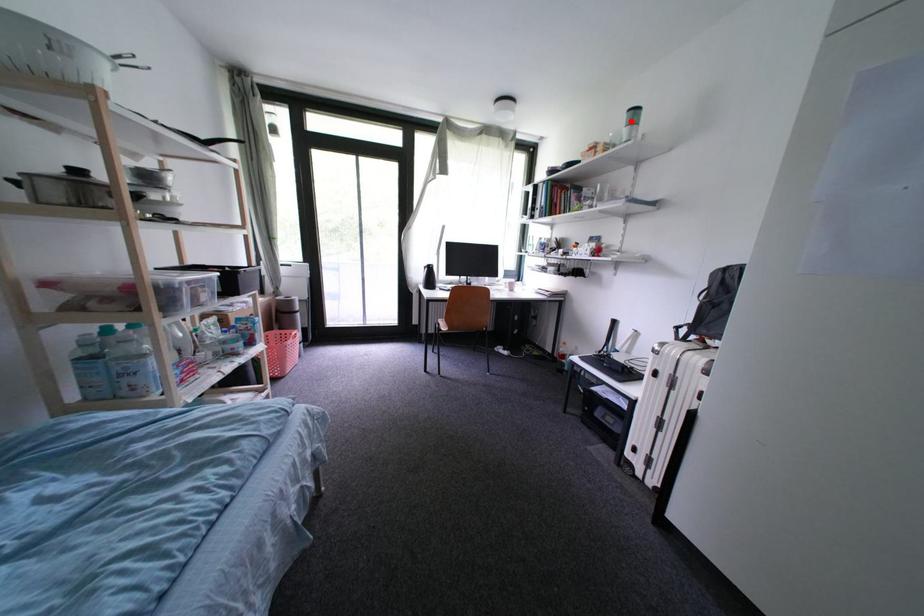
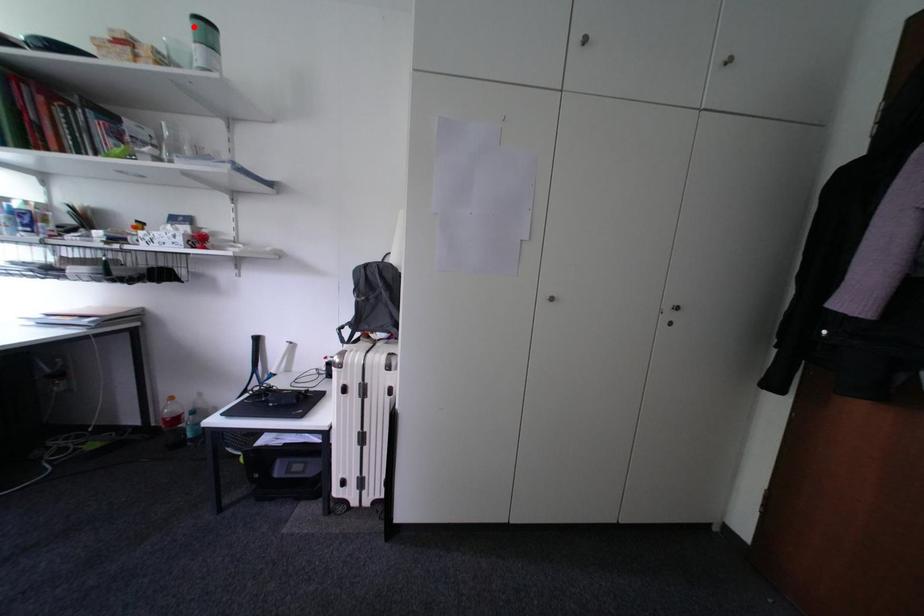
I am providing you with two images of the same scene from different viewpoints. A red point is marked on the first image and another point is marked on the second image. Do the highlighted points in image1 and image2 indicate the same real-world spot?

Yes